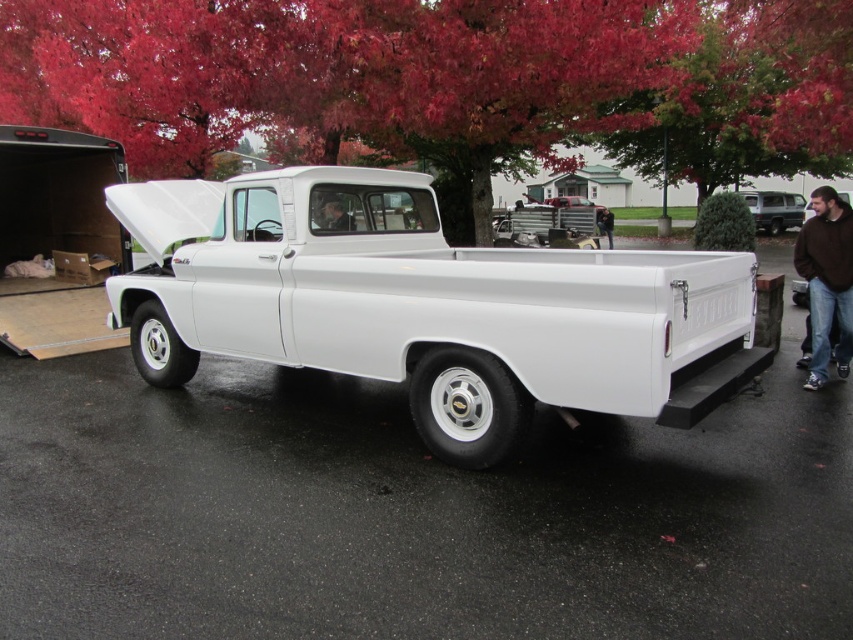
How much distance is there between reddish-brown bark tree at upper center and matte black shirt at center?

A distance of 12.55 meters exists between reddish-brown bark tree at upper center and matte black shirt at center.

From the picture: Who is more forward, (125,138) or (347,214)?

Point (347,214)

Where is `reddish-brown bark tree at upper center`? The width and height of the screenshot is (853, 640). reddish-brown bark tree at upper center is located at coordinates (447, 80).

Locate an element on the screen. This screenshot has width=853, height=640. reddish-brown bark tree at upper center is located at coordinates (447, 80).

Is point (352, 67) positioned before point (822, 276)?

No, it is behind (822, 276).

Can you confirm if reddish-brown bark tree at upper center is positioned below brown fuzzy sweater at right?

Incorrect, reddish-brown bark tree at upper center is not positioned below brown fuzzy sweater at right.

Does point (144, 125) come behind point (833, 221)?

Yes, it is behind point (833, 221).

Find the location of `reddish-brown bark tree at upper center`. reddish-brown bark tree at upper center is located at coordinates (447, 80).

Between point (541, 29) and point (233, 272), which one is positioned in front?

Point (233, 272)

Does point (468, 115) come closer to viewer compared to point (349, 186)?

No, (468, 115) is behind (349, 186).

Where is `reddish-brown bark tree at upper center`? reddish-brown bark tree at upper center is located at coordinates (447, 80).